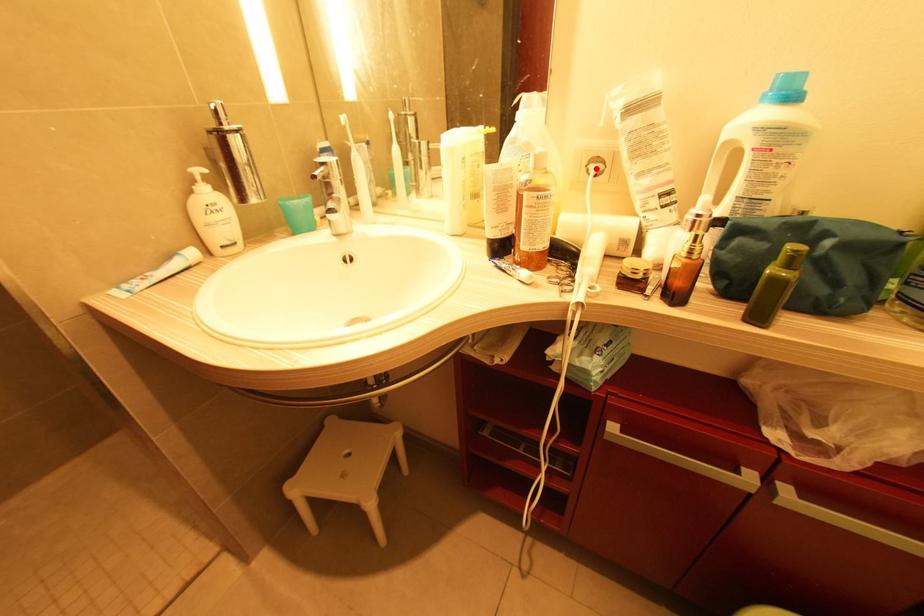
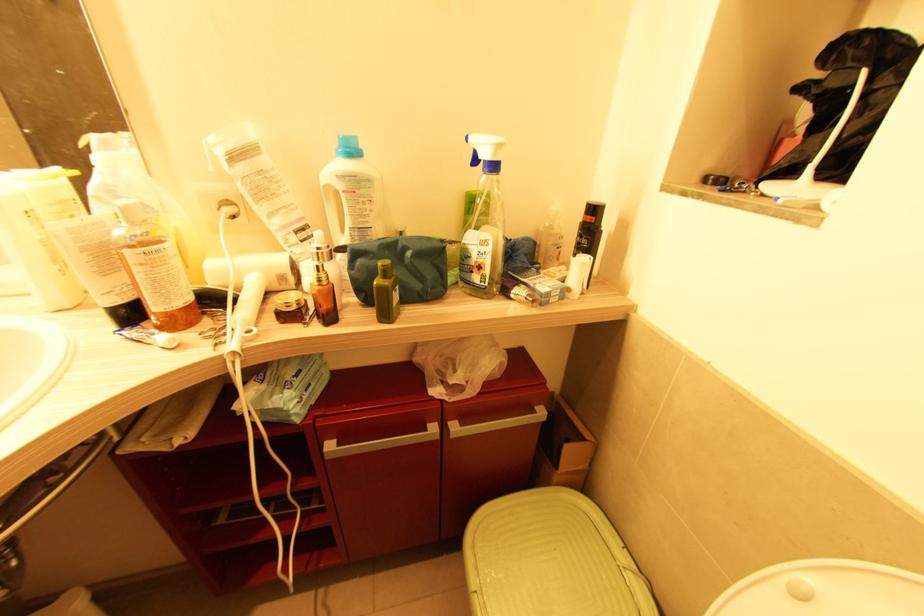
The point at the highlighted location is marked in the first image. Where is the corresponding point in the second image?

(229, 211)